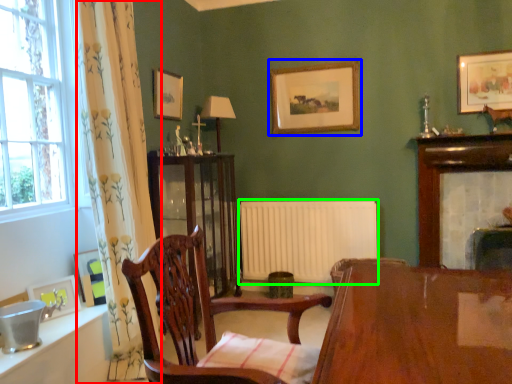
Question: Considering the real-world distances, which object is closest to curtain (highlighted by a red box)? picture frame (highlighted by a blue box) or radiator (highlighted by a green box).

Choices:
 (A) picture frame
 (B) radiator

Answer: (B)